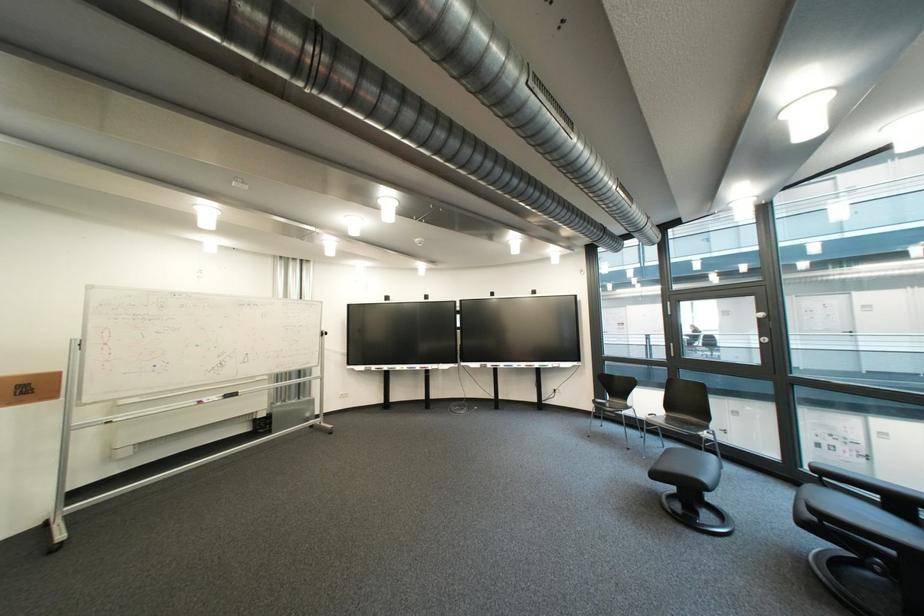
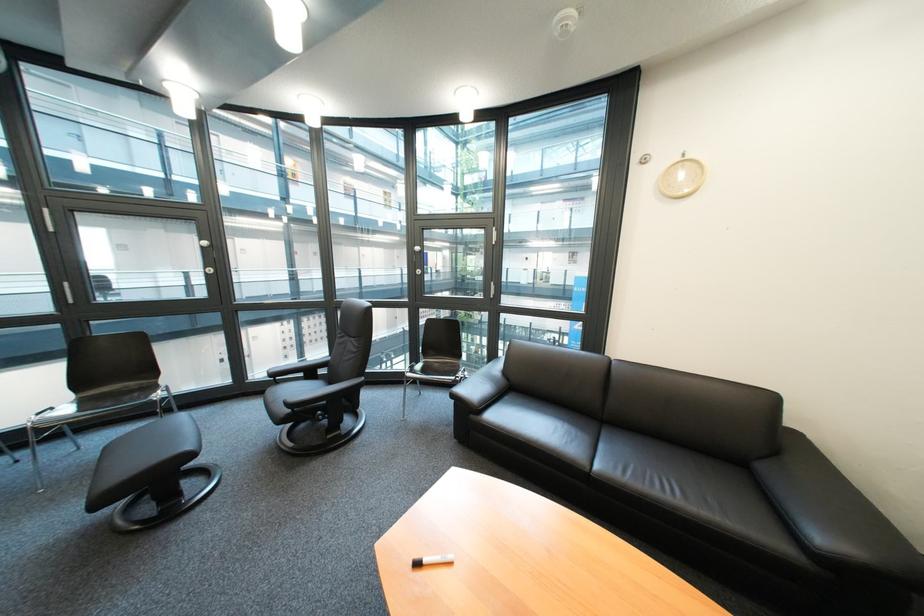
Locate, in the second image, the point that corresponds to point 682,419 in the first image.

(98, 403)